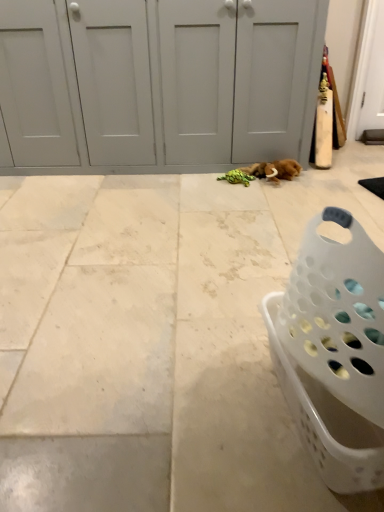
Locate an element on the screen. The width and height of the screenshot is (384, 512). free spot in front of white matte door at center is located at coordinates (140, 240).